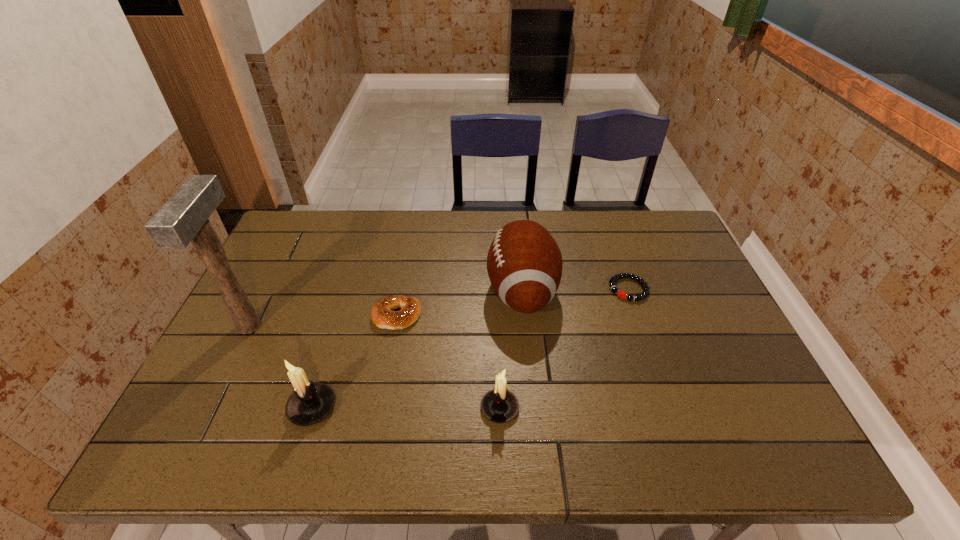
At what (x,y) coordinates should I click in order to perform the action: click on object situated at the left edge. Please return your answer as a coordinate pair (x, y). This screenshot has width=960, height=540. Looking at the image, I should click on (183, 218).

Locate an element on the screen. free space at the far edge of the desktop is located at coordinates (330, 246).

Find the location of `vacant space at the near edge`. vacant space at the near edge is located at coordinates (277, 403).

In the image, there is a desktop. Identify the location of vacant space at the left edge. (246, 366).

Locate an element on the screen. The height and width of the screenshot is (540, 960). vacant space at the right edge of the desktop is located at coordinates (704, 293).

You are a GUI agent. You are given a task and a screenshot of the screen. Output one action in this format:
    pyautogui.click(x=<x>, y=<y>)
    Task: Click on the free region at the far left corner of the desktop
    Image resolution: width=960 pixels, height=540 pixels.
    Given the screenshot: What is the action you would take?
    pyautogui.click(x=323, y=248)

Find the location of `free spot between the taller candle holder and the bracelet`. free spot between the taller candle holder and the bracelet is located at coordinates (470, 348).

Where is `vacant area that lies between the fifth shortest object and the fifth object from right to left`? vacant area that lies between the fifth shortest object and the fifth object from right to left is located at coordinates (417, 349).

This screenshot has height=540, width=960. I want to click on empty space between the mallet and the bracelet, so click(x=439, y=308).

Find the location of a particular element. Image resolution: width=960 pixels, height=540 pixels. vacant space that's between the bracelet and the football is located at coordinates (575, 290).